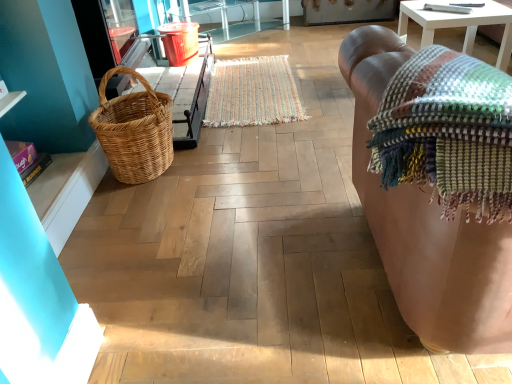
Question: Would you say woven natural picnic basket at left is outside leather couch at right?

Choices:
 (A) yes
 (B) no

Answer: (A)

Question: From a real-world perspective, is woven natural picnic basket at left over leather couch at right?

Choices:
 (A) yes
 (B) no

Answer: (B)

Question: From the image's perspective, is woven natural picnic basket at left over leather couch at right?

Choices:
 (A) yes
 (B) no

Answer: (A)

Question: Does woven natural picnic basket at left appear on the right side of leather couch at right?

Choices:
 (A) yes
 (B) no

Answer: (B)

Question: Is woven natural picnic basket at left looking in the opposite direction of leather couch at right?

Choices:
 (A) no
 (B) yes

Answer: (A)

Question: Is woven natural picnic basket at left bigger than leather couch at right?

Choices:
 (A) yes
 (B) no

Answer: (B)

Question: Does leather couch at right have a lesser height compared to multicolored woven blanket at right?

Choices:
 (A) yes
 (B) no

Answer: (B)

Question: Would you say multicolored woven blanket at right is part of leather couch at right's contents?

Choices:
 (A) no
 (B) yes

Answer: (B)

Question: Can you confirm if leather couch at right is bigger than multicolored woven blanket at right?

Choices:
 (A) no
 (B) yes

Answer: (B)

Question: Is leather couch at right located outside multicolored woven blanket at right?

Choices:
 (A) no
 (B) yes

Answer: (B)

Question: From a real-world perspective, does leather couch at right sit lower than multicolored woven blanket at right?

Choices:
 (A) no
 (B) yes

Answer: (B)

Question: Could you tell me if leather couch at right is facing multicolored woven blanket at right?

Choices:
 (A) no
 (B) yes

Answer: (A)

Question: Can you confirm if multicolored woven mat at center is positioned to the left of multicolored woven blanket at right?

Choices:
 (A) yes
 (B) no

Answer: (A)